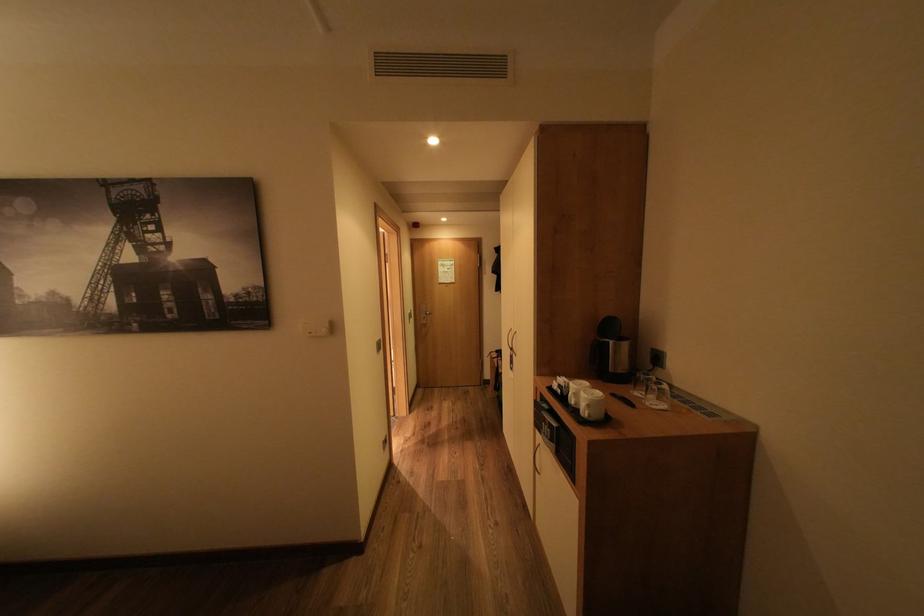
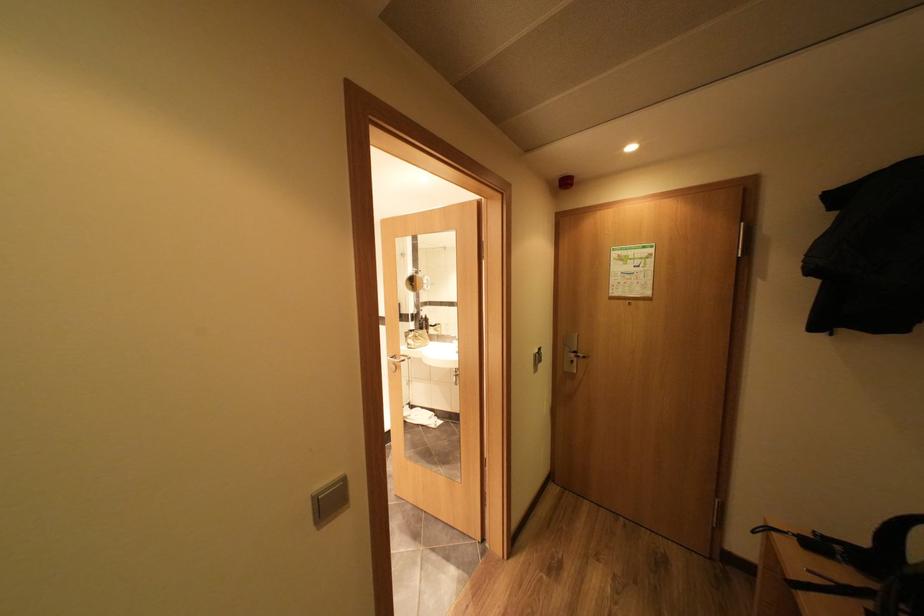
Locate, in the second image, the point that corresponds to point 453,286 in the first image.

(626, 302)